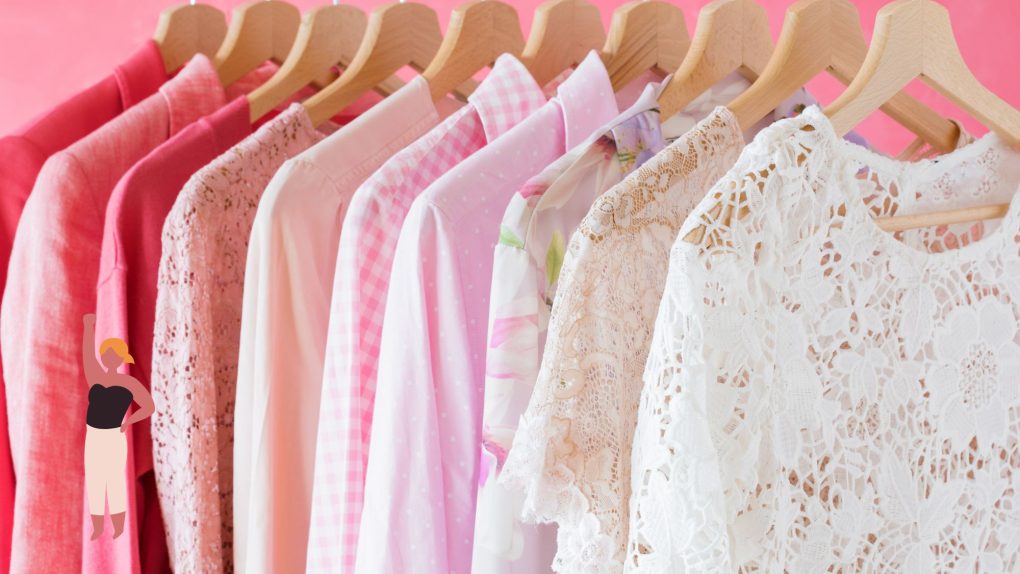
Find the location of a particular element. The image size is (1020, 574). wooden clothes hangers is located at coordinates (191, 33), (268, 33), (326, 34), (402, 33), (483, 38), (563, 34), (639, 38), (720, 45), (811, 46), (914, 46).